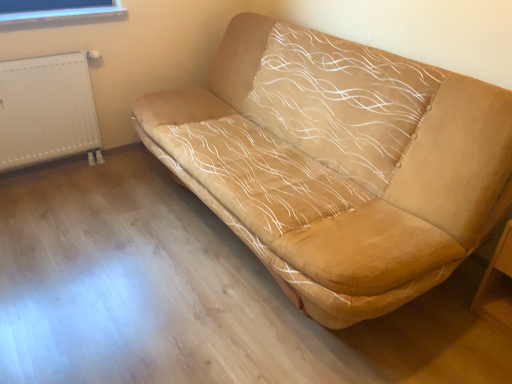
Identify the location of free region under white plastic radiator at left (from a real-world perspective). The height and width of the screenshot is (384, 512). (62, 169).